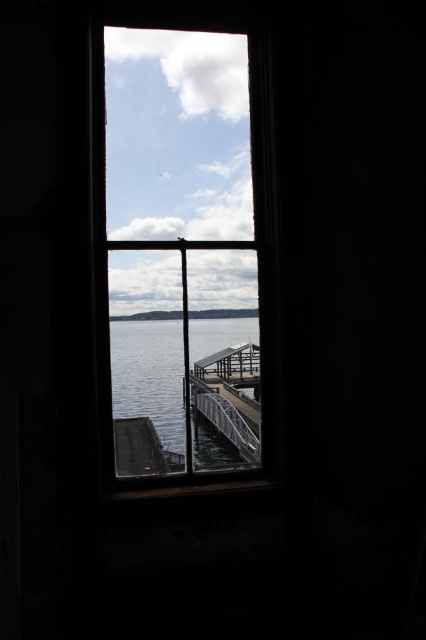
Looking at this image, you are standing in the room looking through the window. There is a wooden frame at center and a metallic gray rail at center. Which object is positioned to the left when viewed from inside the room?

The wooden frame at center is positioned to the left of the metallic gray rail at center when viewed from inside the room.

You are standing in a dimly lit room and looking through the window. You see a metallic gray dock at center and a metallic gray rail at center. Which one is positioned to the right side of the other?

The metallic gray dock at center is positioned to the right of the metallic gray rail at center.

Looking at this image, you are standing in the dimly lit room looking through the window. There is a point at coordinates (189, 285) on the window. If you want to touch that point on the window with a 2.5 meter long stick, will the stick be long enough?

The point at coordinates (189, 285) is 3.09 meters from the camera. Since the stick is only 2.5 meters long, it is not long enough to reach the point.